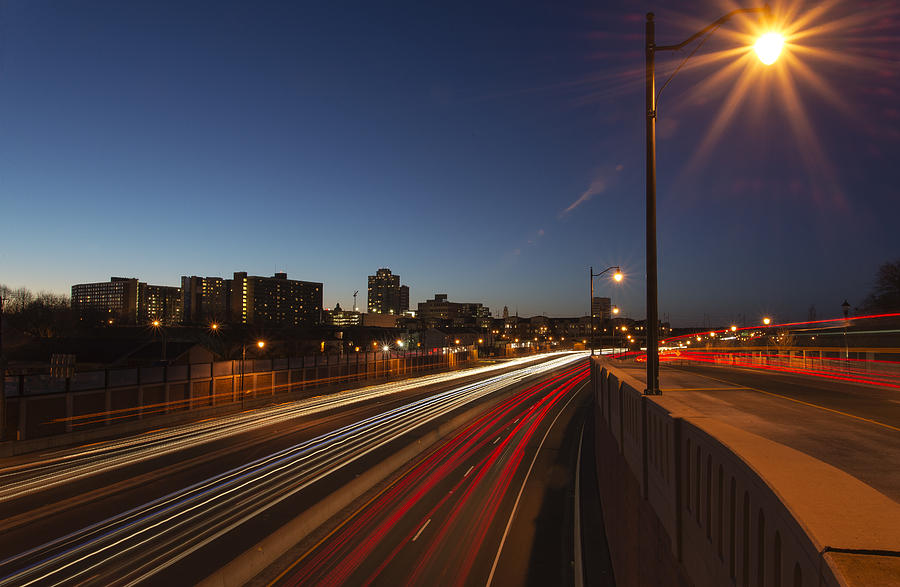
This screenshot has height=587, width=900. I want to click on large white lights, so click(x=615, y=278), click(x=616, y=312).